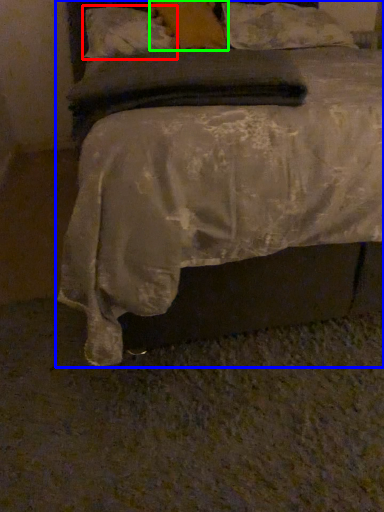
Question: Considering the real-world distances, which object is farthest from pillow (highlighted by a red box)? bed (highlighted by a blue box) or pillow (highlighted by a green box)?

Choices:
 (A) bed
 (B) pillow

Answer: (A)